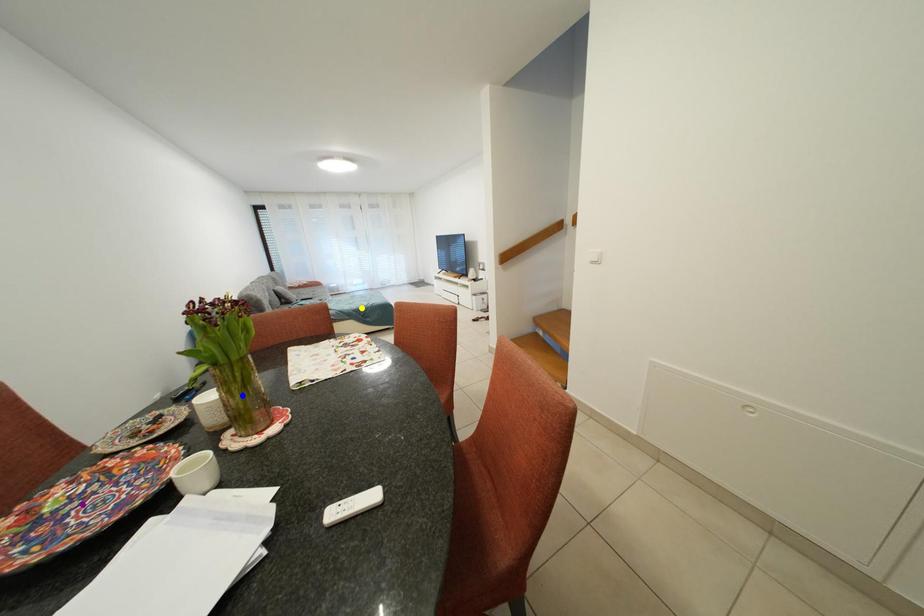
Order these from nearest to farthest:
yellow point | purple point | blue point

purple point
blue point
yellow point